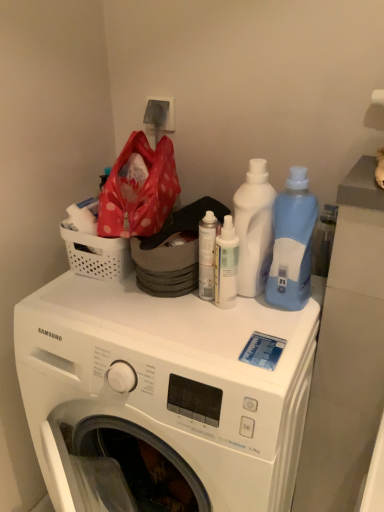
Where is `vacant area that lies in front of blue translucent bottle at right, which is the 1th cleaning product in right-to-left order`? vacant area that lies in front of blue translucent bottle at right, which is the 1th cleaning product in right-to-left order is located at coordinates (272, 337).